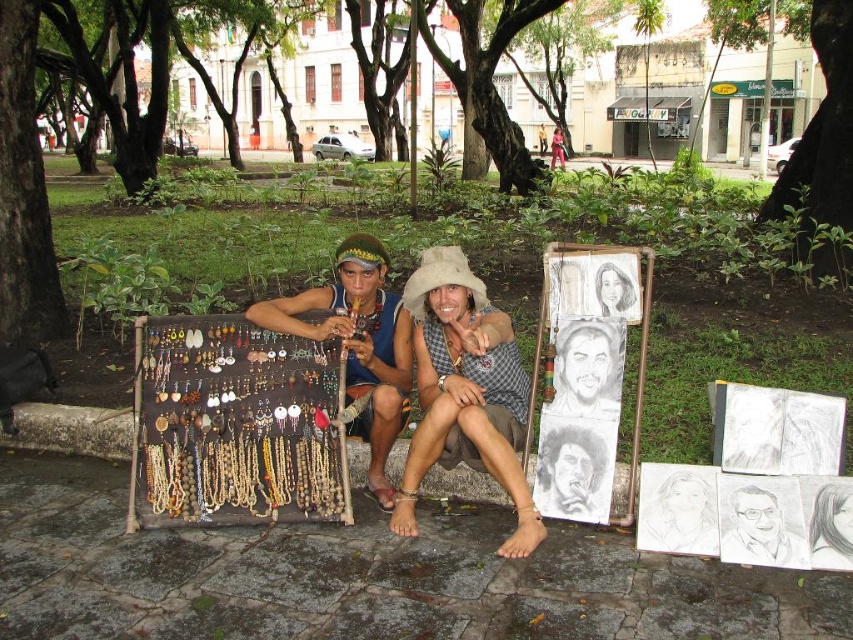
Does wooden beads at center have a greater height compared to wooden beads at left?

Yes.

Does wooden beads at center have a larger size compared to wooden beads at left?

Indeed, wooden beads at center has a larger size compared to wooden beads at left.

Which is in front, point (511, 328) or point (357, 378)?

Point (511, 328)

Locate an element on the screen. Image resolution: width=853 pixels, height=640 pixels. wooden beads at center is located at coordinates (456, 388).